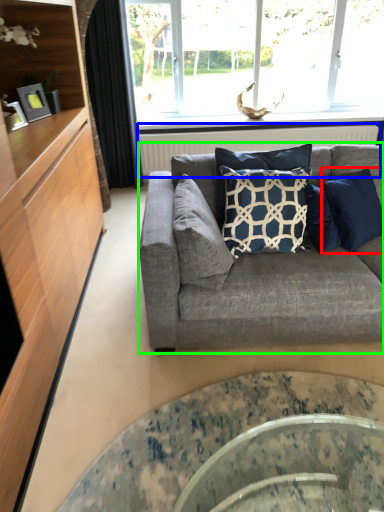
Question: Which object is positioned farthest from pillow (highlighted by a red box)? Select from radiator (highlighted by a blue box) and studio couch (highlighted by a green box).

Choices:
 (A) radiator
 (B) studio couch

Answer: (A)